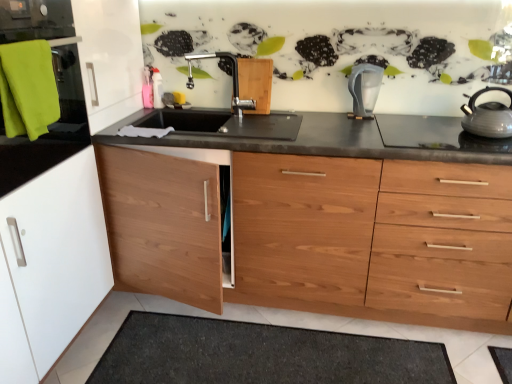
Question: In terms of height, does matte silver faucet at center look taller or shorter compared to black granite countertop at center?

Choices:
 (A) short
 (B) tall

Answer: (A)

Question: Looking at their shapes, would you say matte silver faucet at center is wider or thinner than black granite countertop at center?

Choices:
 (A) wide
 (B) thin

Answer: (B)

Question: Estimate the real-world distances between objects in this image. Which object is closer to the black granite countertop at center?

Choices:
 (A) transparent plastic water filter at center
 (B) shiny silver gas stove at right
 (C) black matte sink at center
 (D) dark gray textured bath mat at lower center
 (E) matte silver faucet at center

Answer: (D)

Question: Considering the real-world distances, which object is farthest from the black matte sink at center?

Choices:
 (A) shiny silver gas stove at right
 (B) matte silver faucet at center
 (C) metallic gray kettle at right
 (D) black granite countertop at center
 (E) transparent plastic water filter at center

Answer: (C)